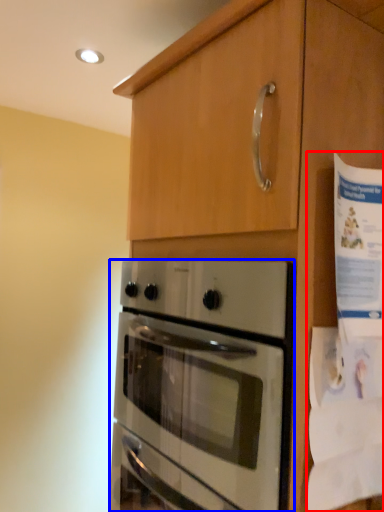
Question: Among these objects, which one is farthest to the camera, paper (highlighted by a red box) or oven (highlighted by a blue box)?

Choices:
 (A) paper
 (B) oven

Answer: (A)